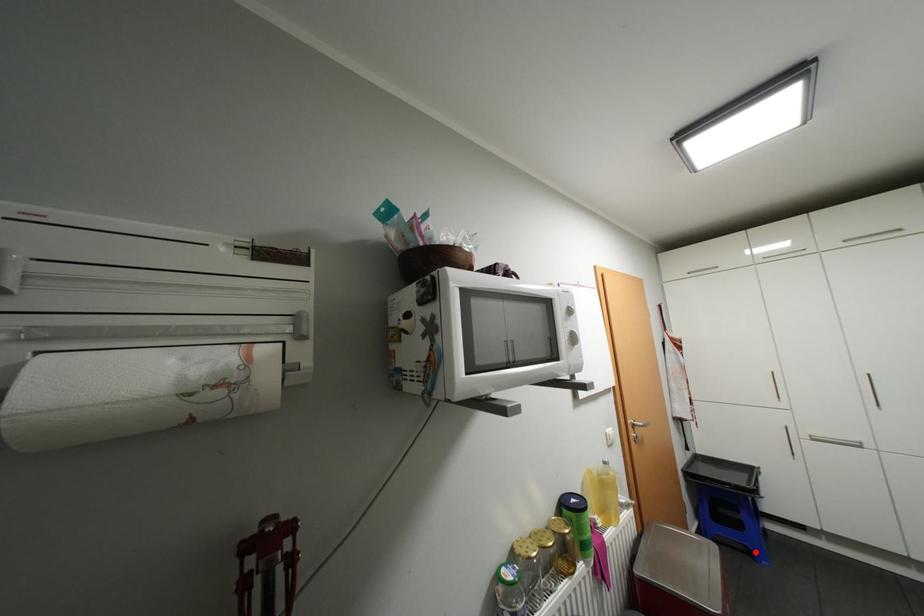
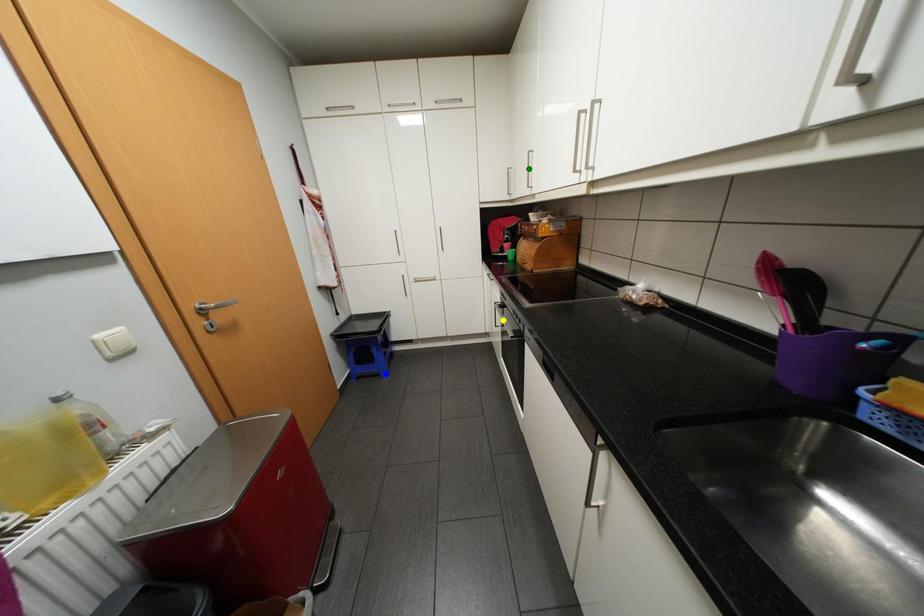
Question: I am providing you with two images of the same scene from different viewpoints. A red point is marked on the first image. You are given multiple points on the second image. Which spot in image 2 lines up with the point in image 1?

Choices:
 (A) yellow point
 (B) green point
 (C) blue point

Answer: (C)